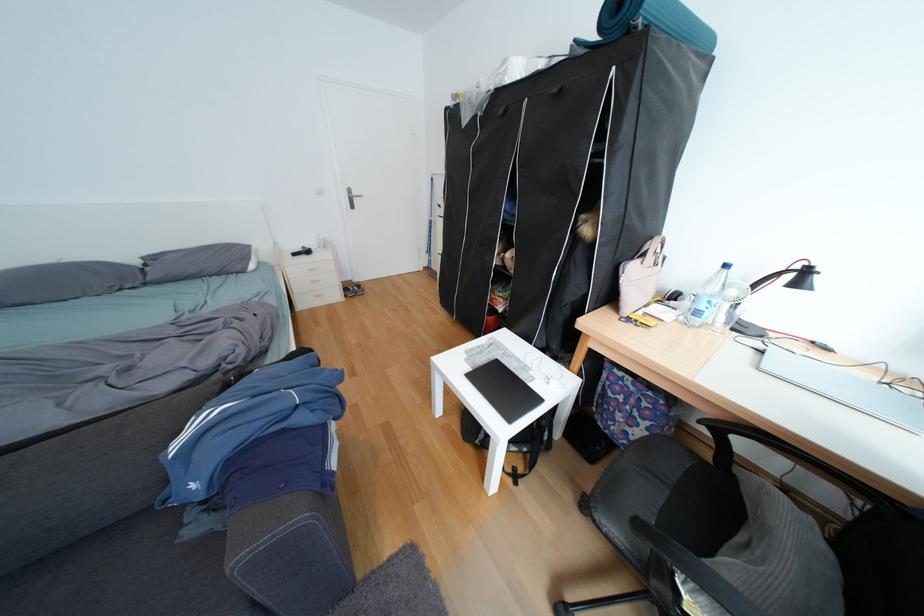
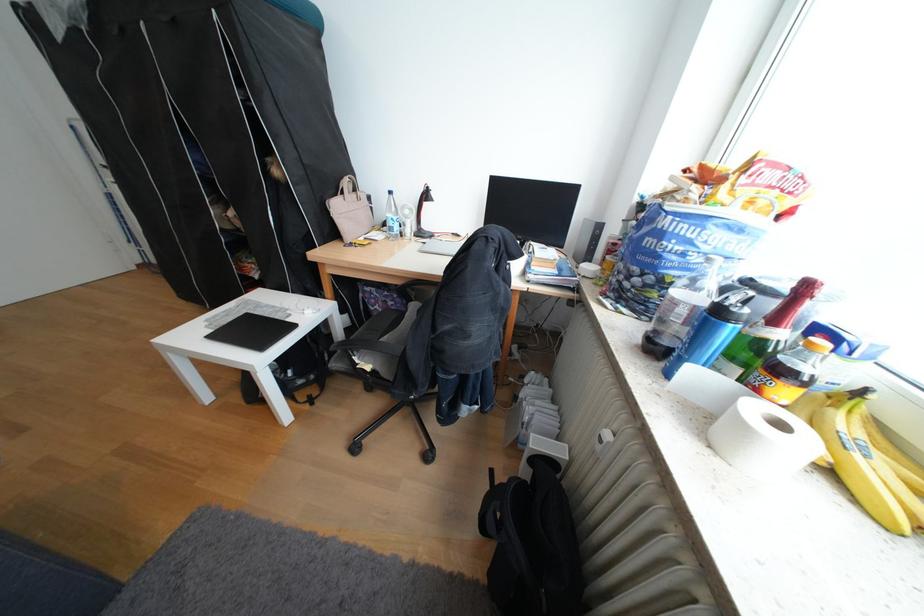
The point at (657, 256) is marked in the first image. Where is the corresponding point in the second image?

(355, 193)